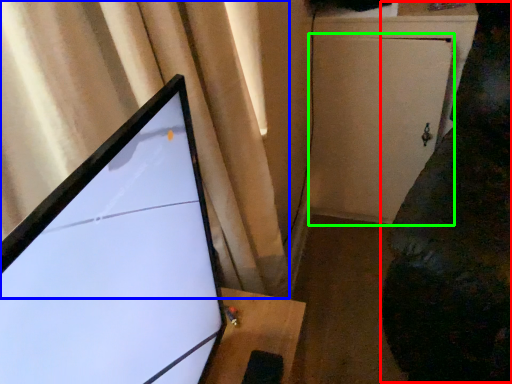
Question: Based on their relative distances, which object is nearer to couch (highlighted by a red box)? Choose from curtain (highlighted by a blue box) and screen door (highlighted by a green box).

Choices:
 (A) curtain
 (B) screen door

Answer: (B)